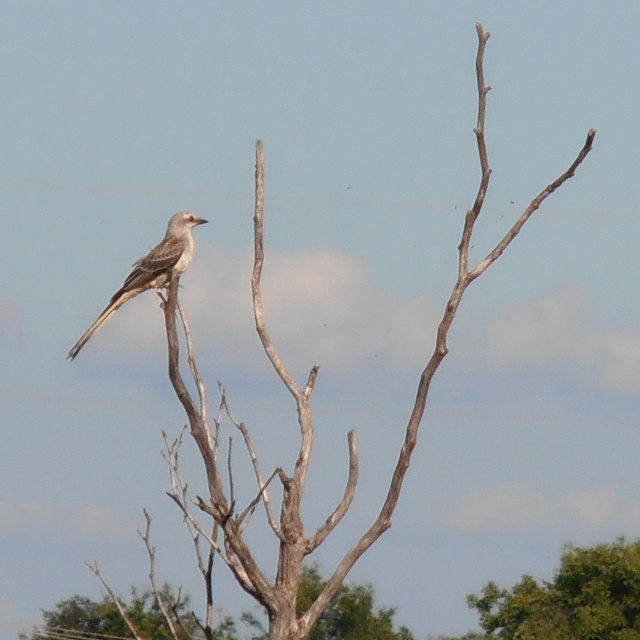
Is brown rough tree trunk at center below grayish-brown feathered bird at center?

Correct, brown rough tree trunk at center is located below grayish-brown feathered bird at center.

In the scene shown: Measure the distance between brown rough tree trunk at center and camera.

They are 74.21 feet apart.

Who is more forward, (90,636) or (125,294)?

Point (125,294)

This screenshot has height=640, width=640. What are the coordinates of `brown rough tree trunk at center` in the screenshot? It's located at (356, 618).

Who is higher up, green leafy tree at lower right or brown rough tree trunk at center?

green leafy tree at lower right

Who is shorter, green leafy tree at lower right or brown rough tree trunk at center?

Standing shorter between the two is brown rough tree trunk at center.

This screenshot has height=640, width=640. In order to click on green leafy tree at lower right in this screenshot , I will do point(568,596).

Can you confirm if green leafy tree at lower right is positioned to the left of grayish-brown feathered bird at center?

No, green leafy tree at lower right is not to the left of grayish-brown feathered bird at center.

Where is `green leafy tree at lower right`? The height and width of the screenshot is (640, 640). green leafy tree at lower right is located at coordinates (568, 596).